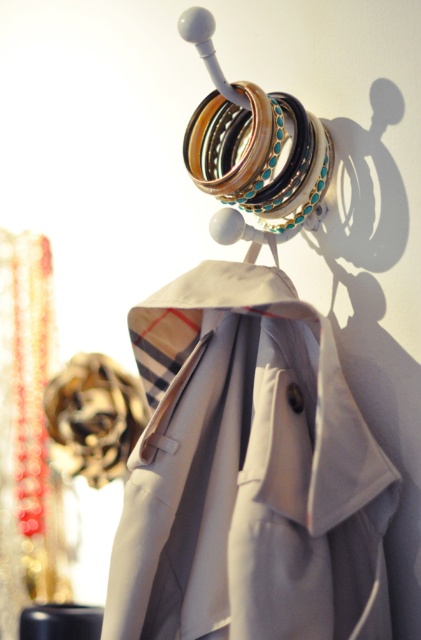
Question: Which point is farther from the camera taking this photo?

Choices:
 (A) (176, 456)
 (B) (285, 225)

Answer: (B)

Question: Does light beige fabric coat at center appear under shiny gold bangles at center?

Choices:
 (A) no
 (B) yes

Answer: (B)

Question: Which point appears closest to the camera in this image?

Choices:
 (A) (260, 360)
 (B) (263, 161)

Answer: (A)

Question: Can you confirm if light beige fabric coat at center is positioned to the right of shiny gold bangles at center?

Choices:
 (A) yes
 (B) no

Answer: (B)

Question: Is light beige fabric coat at center below shiny gold bangles at center?

Choices:
 (A) no
 (B) yes

Answer: (B)